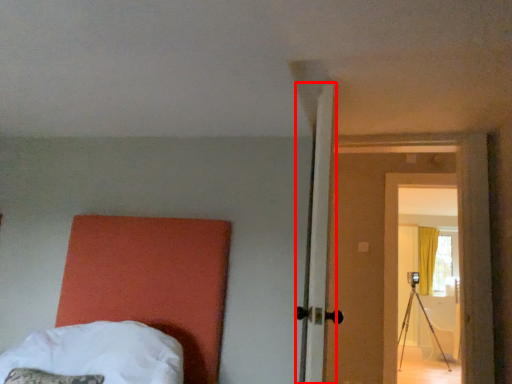
Question: From the image's perspective, what is the correct spatial positioning of door (annotated by the red box) in reference to bed?

Choices:
 (A) below
 (B) above

Answer: (B)